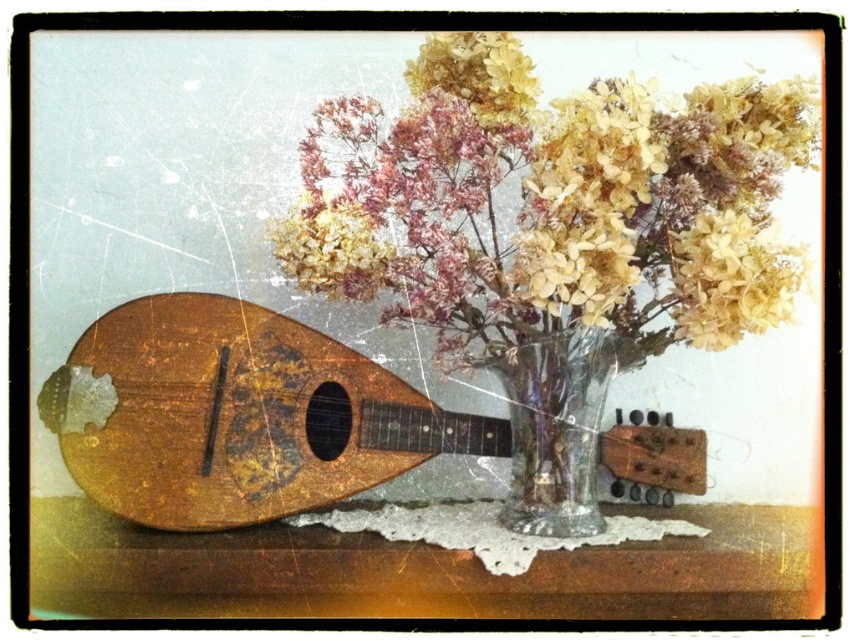
You are standing in front of the still life scene and want to place a small sticker on the point that is closer to you. Which point should you choose between point [473,440] and point [498,358]?

Point [498,358] is closer to you because it is in front of point [473,440].

You are an interior designer arranging items on a shelf. You have a translucent glass vase at center and a wooden mandolin at left. Based on the scene, which object is positioned higher up?

The translucent glass vase at center is above the wooden mandolin at left, so it is positioned higher up.